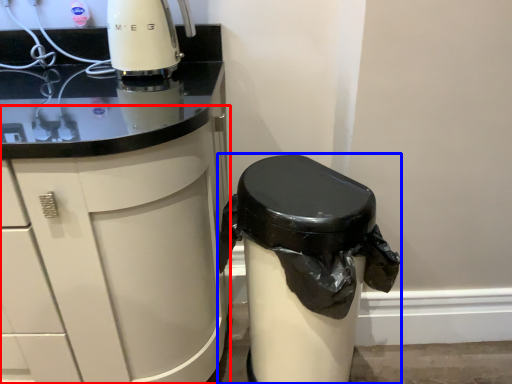
Question: Which point is closer to the camera, cabinetry (highlighted by a red box) or waste container (highlighted by a blue box)?

Choices:
 (A) cabinetry
 (B) waste container

Answer: (A)